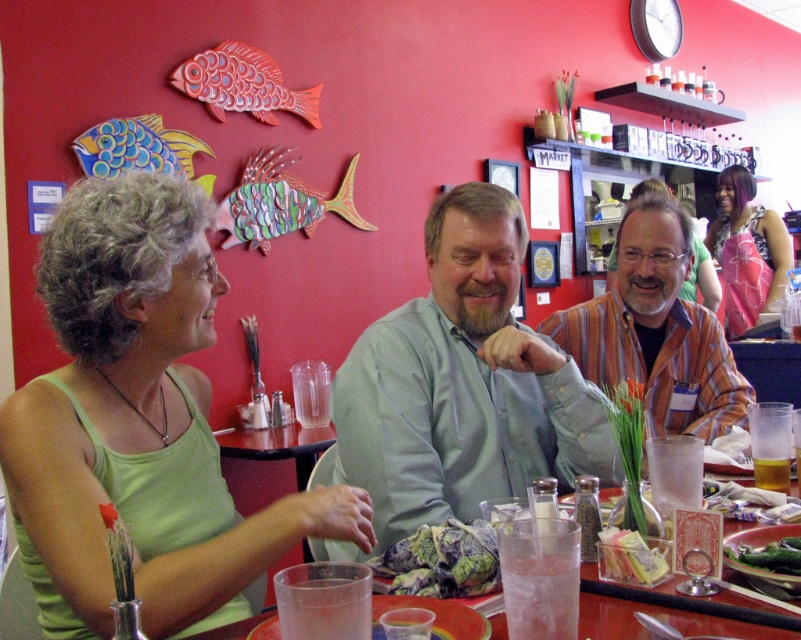
Question: Which is farther from the clear glass cup at lower center?

Choices:
 (A) green leafy vegetable at lower right
 (B) metallic multicolored fish at upper center
 (C) matte blue and yellow fish at upper left

Answer: (B)

Question: Which object is positioned closest to the clear plastic cups at center?

Choices:
 (A) textured fabric napkin at lower center
 (B) green leafy vegetable at lower right
 (C) green fabric tank top at upper left

Answer: (C)

Question: Can you confirm if pink satin dress at upper right is positioned above clear plastic cup at center?

Choices:
 (A) yes
 (B) no

Answer: (A)

Question: Does green fabric tank top at upper left have a larger size compared to translucent glass cup at table center?

Choices:
 (A) yes
 (B) no

Answer: (A)

Question: Does textured fabric napkin at lower center appear under metallic red fish at upper left?

Choices:
 (A) no
 (B) yes

Answer: (B)

Question: Which is farther from the clear plastic cups at center?

Choices:
 (A) matte blue and yellow fish at upper left
 (B) metallic red fish at upper left

Answer: (B)